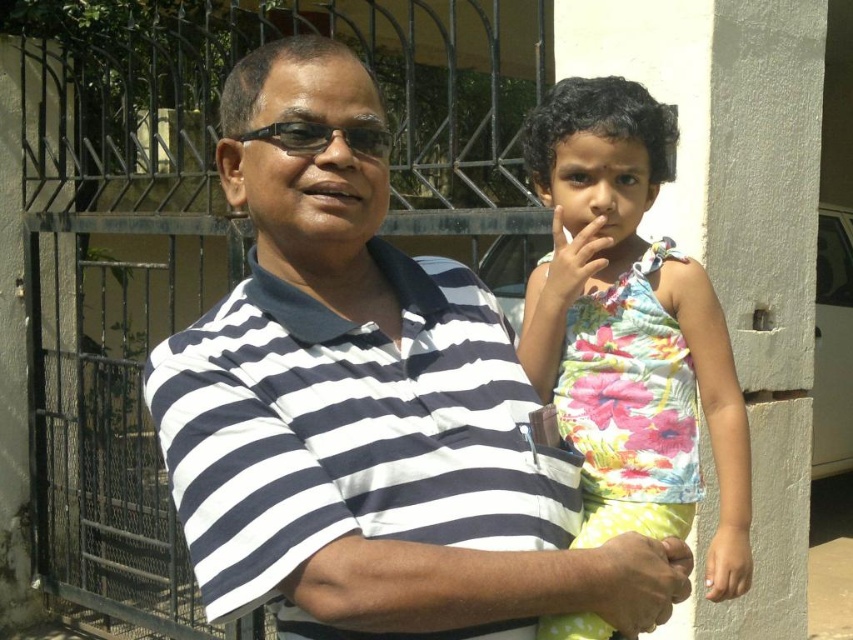
Question: Which of these objects is positioned closest to the floral fabric dress at center?

Choices:
 (A) black plastic glasses at center
 (B) white striped shirt at center

Answer: (B)

Question: Estimate the real-world distances between objects in this image. Which object is farther from the floral fabric dress at center?

Choices:
 (A) white striped shirt at center
 (B) black plastic glasses at center

Answer: (B)

Question: Does white striped shirt at center appear under floral fabric dress at center?

Choices:
 (A) no
 (B) yes

Answer: (B)

Question: Can you confirm if floral fabric dress at center is smaller than black plastic glasses at center?

Choices:
 (A) yes
 (B) no

Answer: (B)

Question: Can you confirm if white striped shirt at center is positioned to the left of black plastic glasses at center?

Choices:
 (A) yes
 (B) no

Answer: (B)

Question: Which point is closer to the camera?

Choices:
 (A) (492, 604)
 (B) (386, 156)
 (C) (584, 161)

Answer: (A)